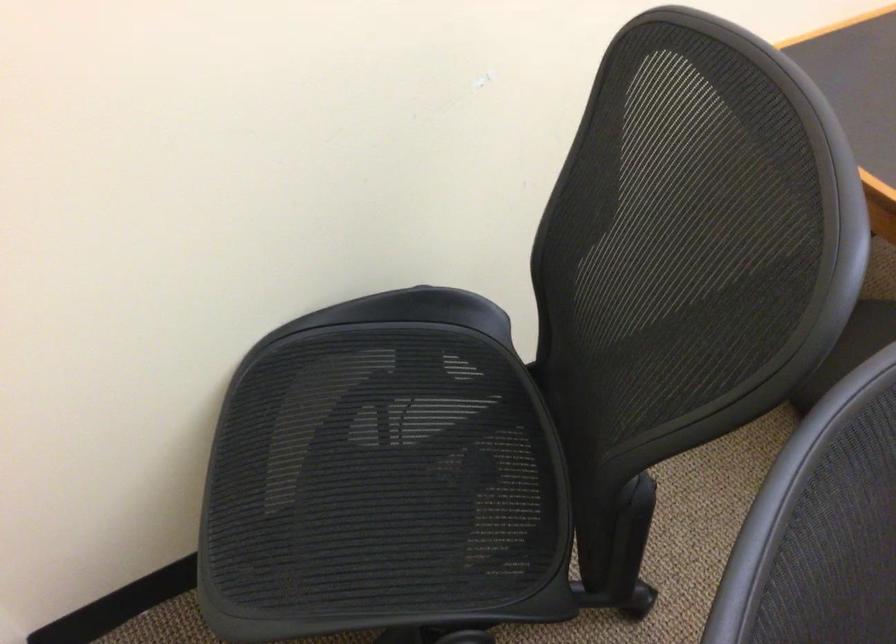
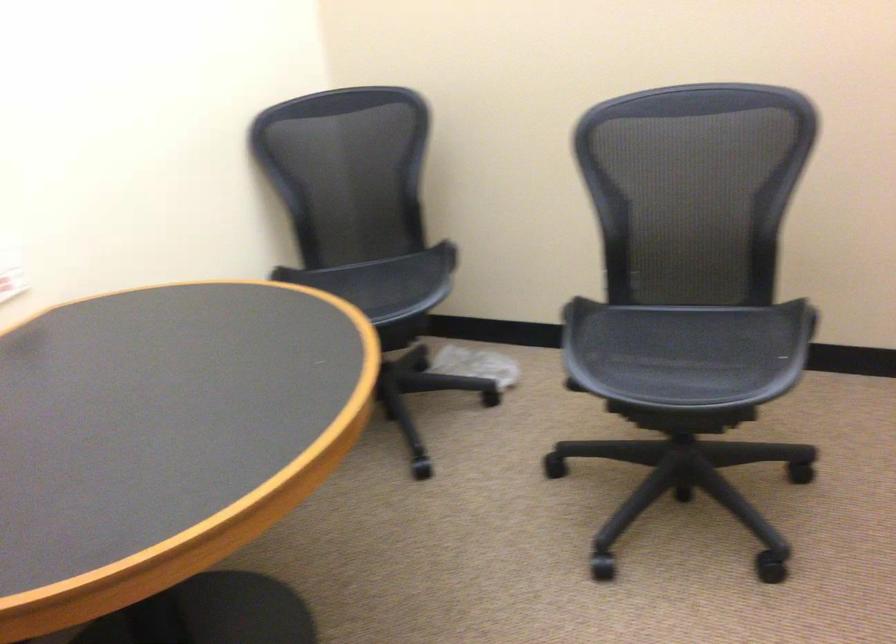
Question: The first image is from the beginning of the video and the second image is from the end. How did the camera likely rotate when shooting the video?

Choices:
 (A) Left
 (B) Right
 (C) Up
 (D) Down

Answer: (B)